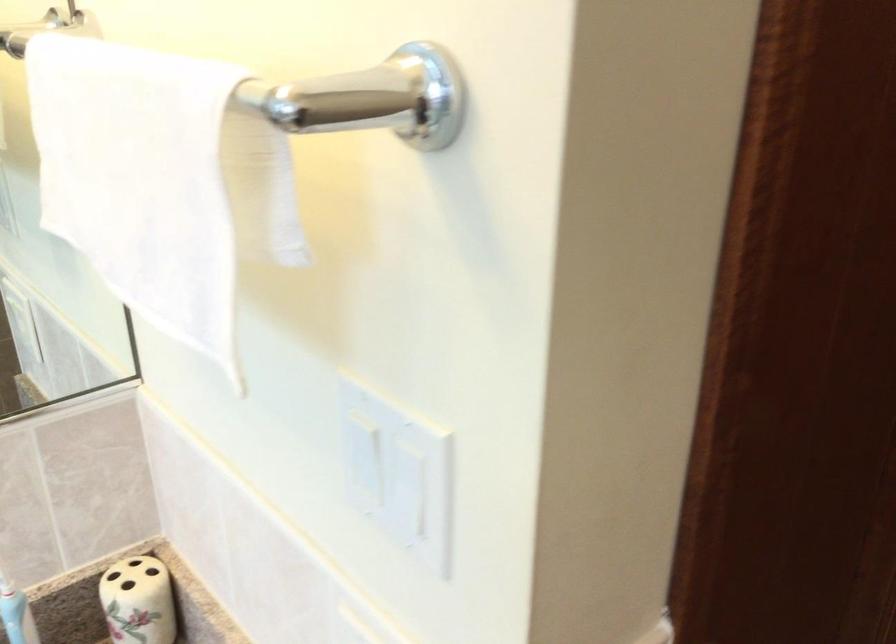
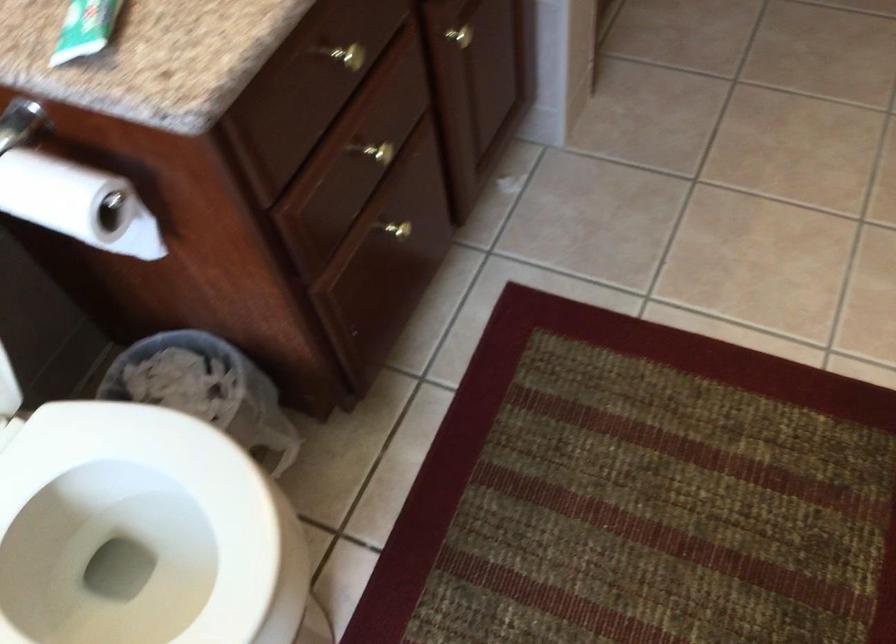
Question: The first image is from the beginning of the video and the second image is from the end. How did the camera likely rotate when shooting the video?

Choices:
 (A) Left
 (B) Right
 (C) Up
 (D) Down

Answer: (D)